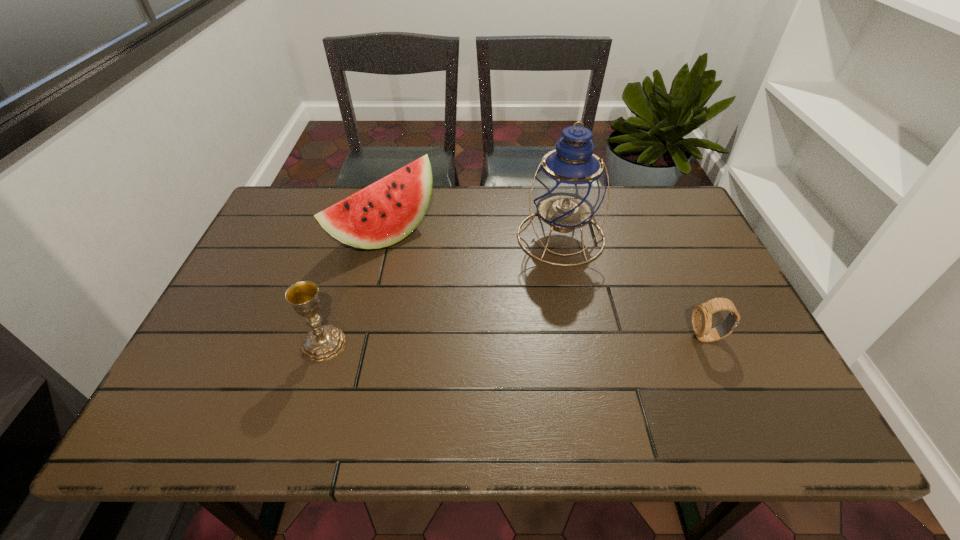
The width and height of the screenshot is (960, 540). In order to click on free space located on the outer rind of the watermelon in this screenshot , I will do `click(431, 261)`.

Where is `vacant space located 0.180m on the outer rind of the watermelon`? Image resolution: width=960 pixels, height=540 pixels. vacant space located 0.180m on the outer rind of the watermelon is located at coordinates (467, 284).

Locate an element on the screen. The image size is (960, 540). vacant space located 0.110m on the outer rind of the watermelon is located at coordinates (447, 272).

Locate an element on the screen. The image size is (960, 540). free space located on the front-facing side of the tallest object is located at coordinates (568, 303).

I want to click on blank area located 0.130m on the front-facing side of the tallest object, so click(568, 303).

Image resolution: width=960 pixels, height=540 pixels. Identify the location of vacant area situated on the front-facing side of the tallest object. point(574,345).

Identify the location of watermelon at the far edge. The height and width of the screenshot is (540, 960). (385, 212).

The width and height of the screenshot is (960, 540). I want to click on lantern that is at the far edge, so click(569, 187).

Where is `object that is at the near edge`? object that is at the near edge is located at coordinates (323, 343).

The width and height of the screenshot is (960, 540). Find the location of `object that is at the right edge`. object that is at the right edge is located at coordinates (701, 318).